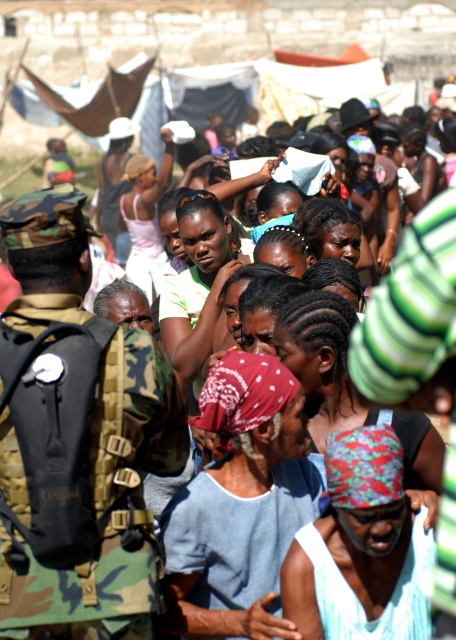
Does light blue fabric at center appear on the right side of matte black sunglasses at center?

Yes, light blue fabric at center is to the right of matte black sunglasses at center.

Is light blue fabric at center thinner than matte black sunglasses at center?

No.

Does point (213, 579) come behind point (191, 321)?

No, it is not.

Locate an element on the screen. The image size is (456, 640). light blue fabric at center is located at coordinates (239, 504).

Can you confirm if light blue fabric at center is positioned below multicolored fabric headscarf at center?

Yes.

Does light blue fabric at center have a greater height compared to multicolored fabric headscarf at center?

Yes, light blue fabric at center is taller than multicolored fabric headscarf at center.

Who is more forward, (238, 566) or (333, 317)?

Point (238, 566) is more forward.

Find the location of a particular element. The height and width of the screenshot is (640, 456). light blue fabric at center is located at coordinates (239, 504).

What do you see at coordinates (97, 497) in the screenshot? The width and height of the screenshot is (456, 640). I see `camo uniform at left` at bounding box center [97, 497].

At what (x,y) coordinates should I click in order to perform the action: click on camo uniform at left. Please return your answer as a coordinate pair (x, y). Looking at the image, I should click on (97, 497).